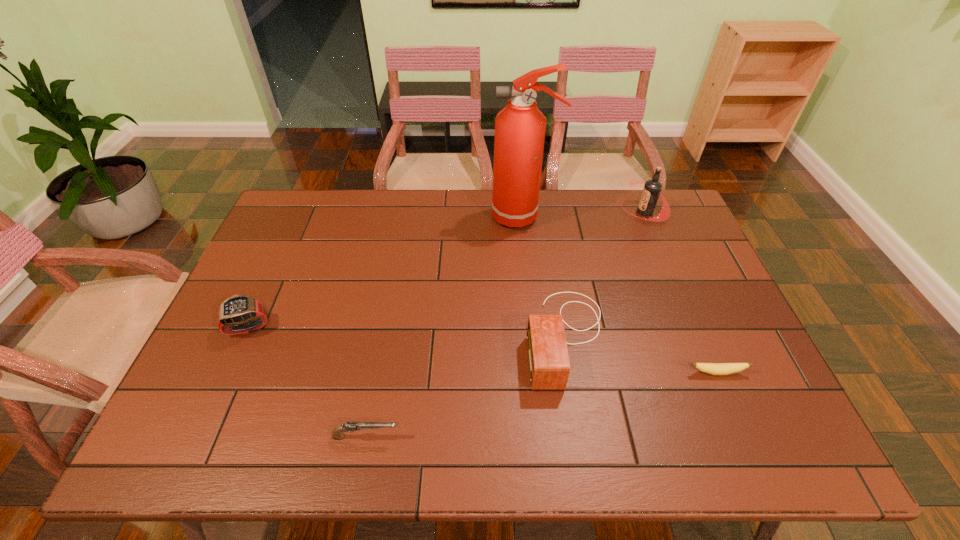
Identify the location of vacant point located between the shortest object and the radio receiver. Image resolution: width=960 pixels, height=540 pixels. (641, 355).

The height and width of the screenshot is (540, 960). What are the coordinates of `object that can be found as the closest to the shortest object` in the screenshot? It's located at (549, 367).

Identify the location of object that is the third closest one to the watch. This screenshot has height=540, width=960. (520, 127).

I want to click on free space in the image that satisfies the following two spatial constraints: 1. on the label of the banana; 2. on the right side of the second tallest object, so click(x=712, y=373).

Where is `vacant space that satisfies the following two spatial constraints: 1. on the front side of the shortest object; 2. aiming along the barrel of the fifth tallest object`? vacant space that satisfies the following two spatial constraints: 1. on the front side of the shortest object; 2. aiming along the barrel of the fifth tallest object is located at coordinates (744, 436).